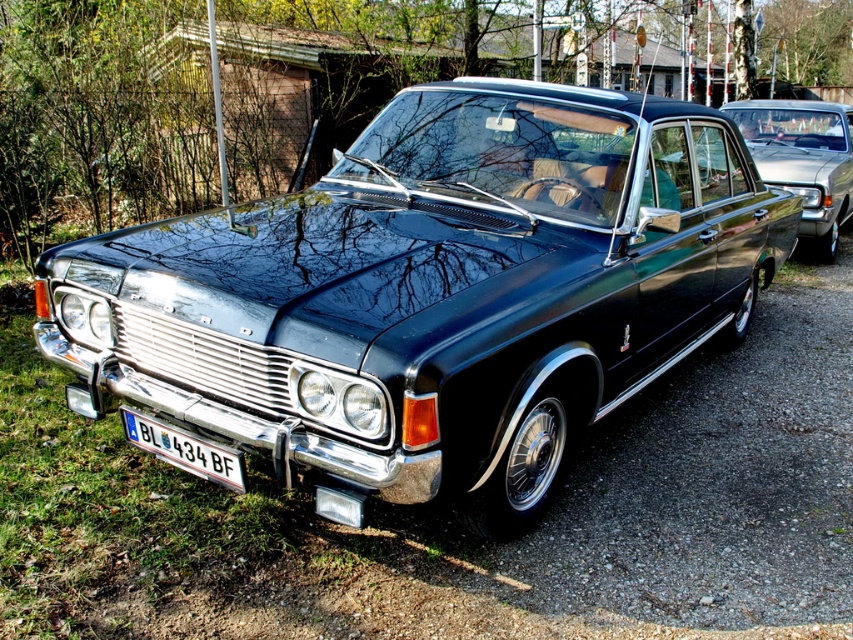
You are a photographer setting up a shoot in front of the shiny black car at center and the shiny metallic sedan at center. You want to position your camera so that both vehicles are visible in the frame. Which vehicle should you place closer to the bottom of the frame to ensure both are fully visible?

The shiny black car at center is below the shiny metallic sedan at center, so to ensure both are fully visible in the frame, you should position the camera so that the shiny black car at center is closer to the bottom of the frame and the shiny metallic sedan at center is higher up.

You are a photographer trying to capture the shiny black car at center and the white plastic license plate at lower left in a single shot. Based on their positions, which object will appear closer to the bottom of your photo?

The white plastic license plate at lower left will appear closer to the bottom of the photo because it is positioned below the shiny black car at center.